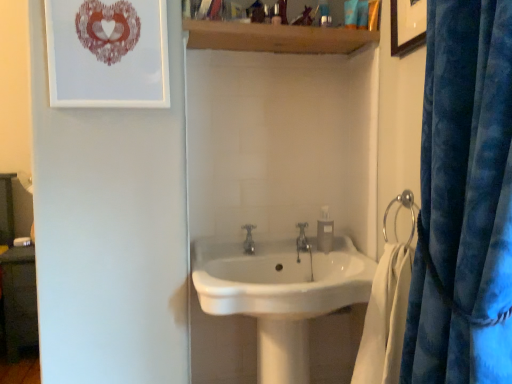
Question: Can you confirm if wooden shelf at upper center is thinner than matte paper picture frame at upper left, the 1th picture frame positioned from the left?

Choices:
 (A) yes
 (B) no

Answer: (B)

Question: Is wooden shelf at upper center bigger than matte paper picture frame at upper left, the 1th picture frame positioned from the left?

Choices:
 (A) no
 (B) yes

Answer: (B)

Question: From a real-world perspective, is wooden shelf at upper center beneath matte paper picture frame at upper left, acting as the 2th picture frame starting from the right?

Choices:
 (A) no
 (B) yes

Answer: (A)

Question: Is wooden shelf at upper center located outside matte paper picture frame at upper left, the 1th picture frame positioned from the left?

Choices:
 (A) no
 (B) yes

Answer: (B)

Question: From the image's perspective, would you say wooden shelf at upper center is positioned over matte paper picture frame at upper left, the 1th picture frame positioned from the left?

Choices:
 (A) yes
 (B) no

Answer: (A)

Question: From the image's perspective, would you say wooden shelf at upper center is shown under matte paper picture frame at upper left, the 1th picture frame positioned from the left?

Choices:
 (A) no
 (B) yes

Answer: (A)

Question: From the image's perspective, is clear plastic soap dispenser at center below white soft towel at lower right?

Choices:
 (A) no
 (B) yes

Answer: (A)

Question: Is clear plastic soap dispenser at center smaller than white soft towel at lower right?

Choices:
 (A) no
 (B) yes

Answer: (B)

Question: Is clear plastic soap dispenser at center taller than white soft towel at lower right?

Choices:
 (A) yes
 (B) no

Answer: (B)

Question: Can you confirm if clear plastic soap dispenser at center is positioned to the right of white soft towel at lower right?

Choices:
 (A) yes
 (B) no

Answer: (B)

Question: Can you confirm if clear plastic soap dispenser at center is thinner than white soft towel at lower right?

Choices:
 (A) yes
 (B) no

Answer: (A)

Question: Does clear plastic soap dispenser at center appear on the left side of white soft towel at lower right?

Choices:
 (A) no
 (B) yes

Answer: (B)

Question: Considering the relative sizes of white soft towel at lower right and silver metallic towel ring at right in the image provided, is white soft towel at lower right smaller than silver metallic towel ring at right?

Choices:
 (A) no
 (B) yes

Answer: (A)